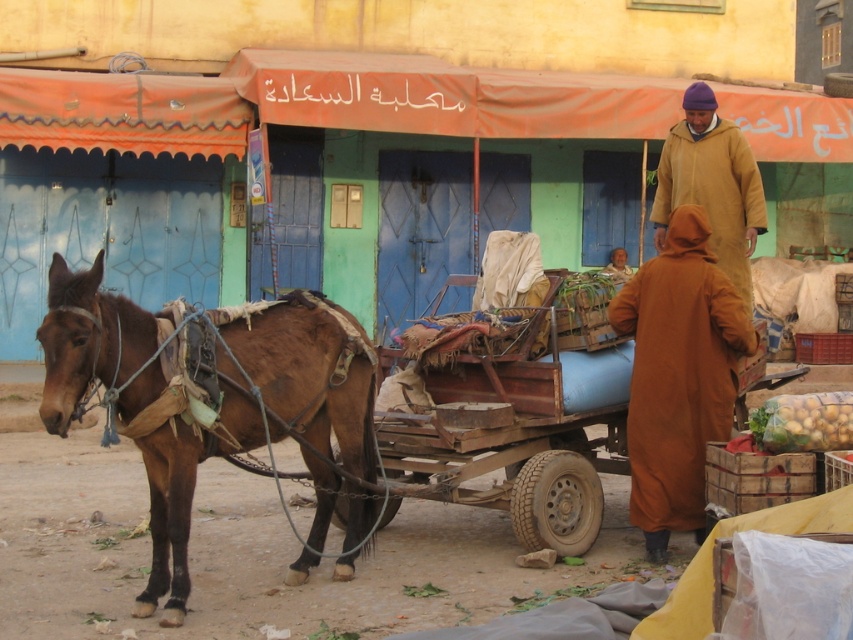
Locate an element on the screen. Image resolution: width=853 pixels, height=640 pixels. brown leather mule at left is located at coordinates pos(311,387).

What do you see at coordinates (311, 387) in the screenshot? This screenshot has width=853, height=640. I see `brown leather mule at left` at bounding box center [311, 387].

The height and width of the screenshot is (640, 853). What do you see at coordinates (311, 387) in the screenshot? I see `brown leather mule at left` at bounding box center [311, 387].

Image resolution: width=853 pixels, height=640 pixels. What are the coordinates of `brown leather mule at left` in the screenshot? It's located at (311, 387).

Find the location of a particular element. This screenshot has height=640, width=853. brown leather mule at left is located at coordinates (x=311, y=387).

Can you confirm if brown leather mule at left is positioned above beige woolen robe at upper right?

Incorrect, brown leather mule at left is not positioned above beige woolen robe at upper right.

Where is `brown leather mule at left`? The image size is (853, 640). brown leather mule at left is located at coordinates (311, 387).

Between brown leather mule at left and brown woolen robe at center, which one appears on the right side from the viewer's perspective?

Positioned to the right is brown woolen robe at center.

Is point (105, 371) positioned before point (648, 560)?

Yes, point (105, 371) is closer to viewer.

At what (x,y) coordinates should I click in order to perform the action: click on brown leather mule at left. Please return your answer as a coordinate pair (x, y). The height and width of the screenshot is (640, 853). Looking at the image, I should click on (311, 387).